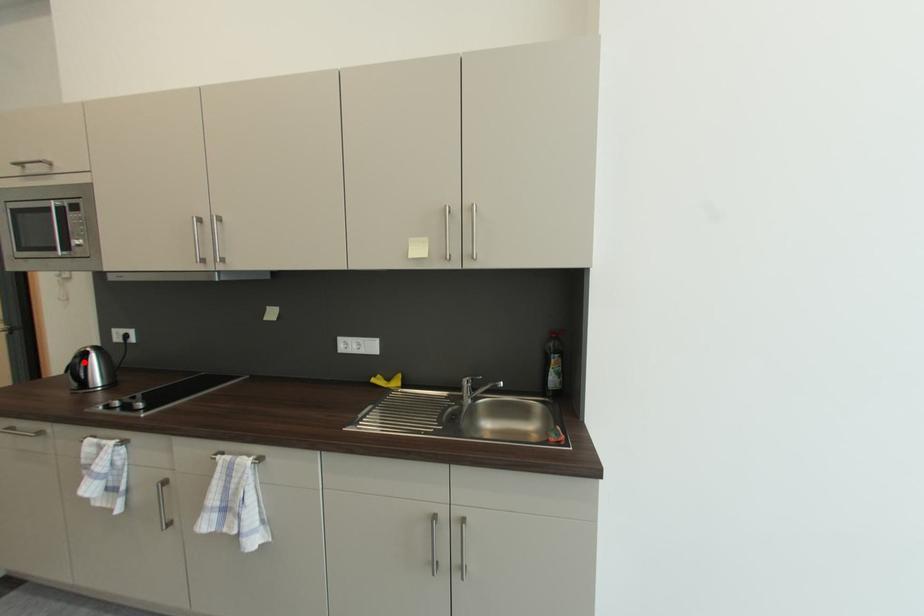
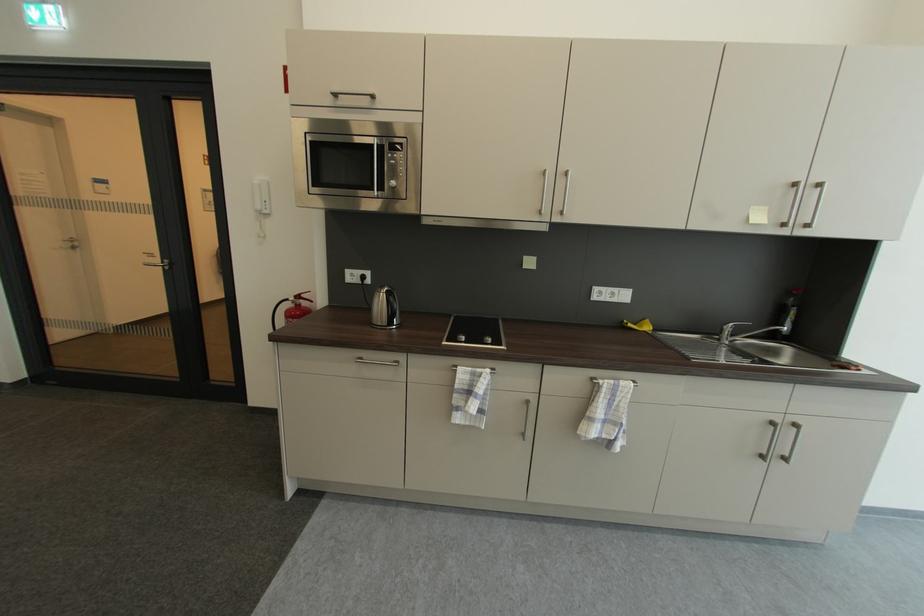
Question: I am providing you with two images of the same scene from different viewpoints. A red point is shown in image1. For the corresponding object point in image2, is it positioned nearer or farther from the camera?

Choices:
 (A) Nearer
 (B) Farther

Answer: (B)